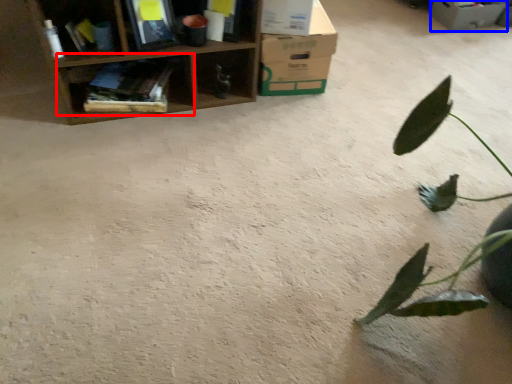
Question: Which object appears farthest to the camera in this image, shelf (highlighted by a red box) or cardboard box (highlighted by a blue box)?

Choices:
 (A) shelf
 (B) cardboard box

Answer: (B)